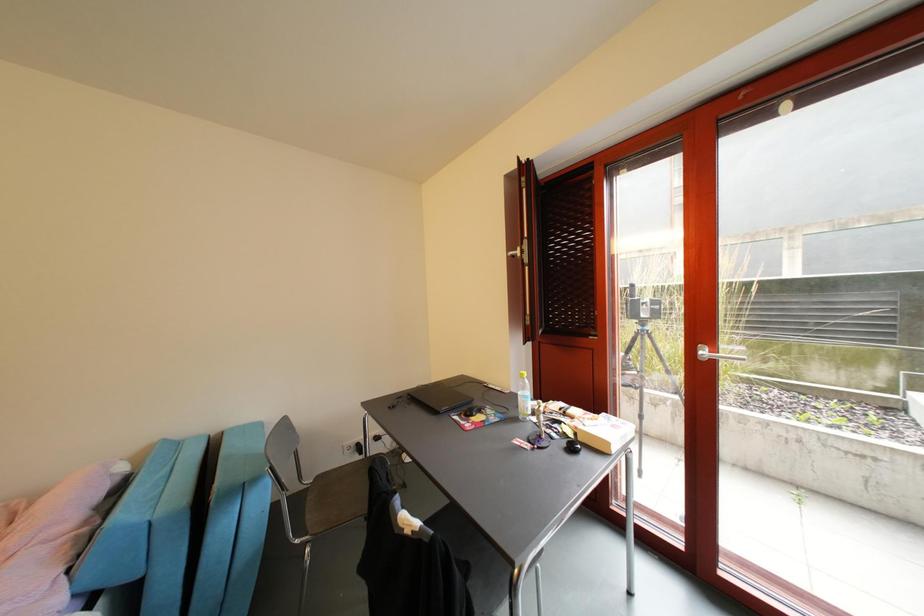
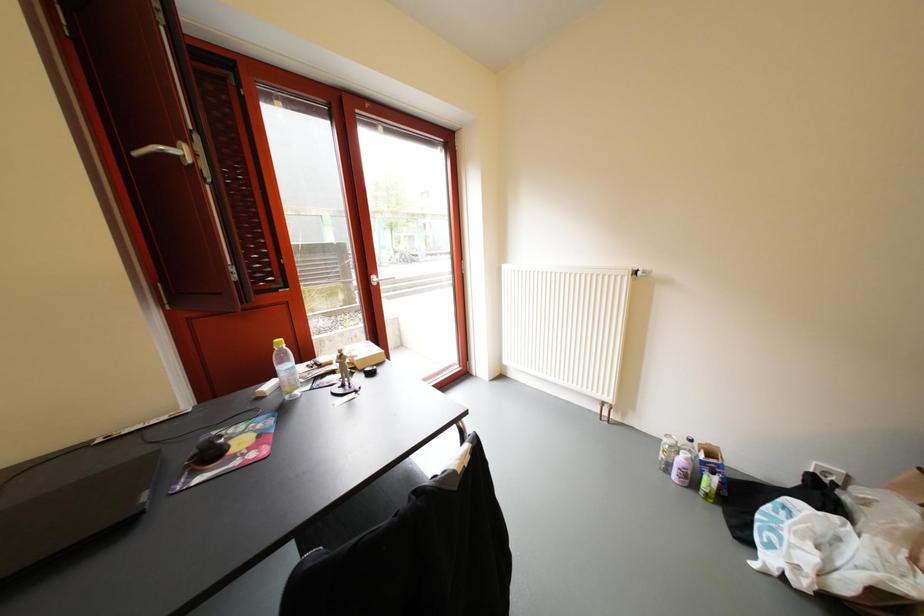
Question: The camera is either moving clockwise (left) or counter-clockwise (right) around the object. The first image is from the beginning of the video and the second image is from the end. Is the camera moving left or right when shooting the video?

Choices:
 (A) Left
 (B) Right

Answer: (A)